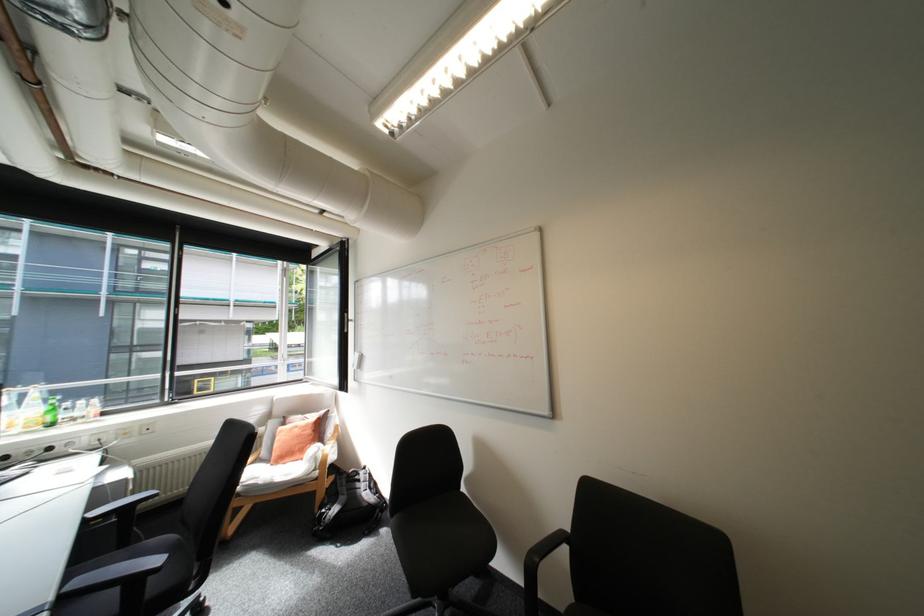
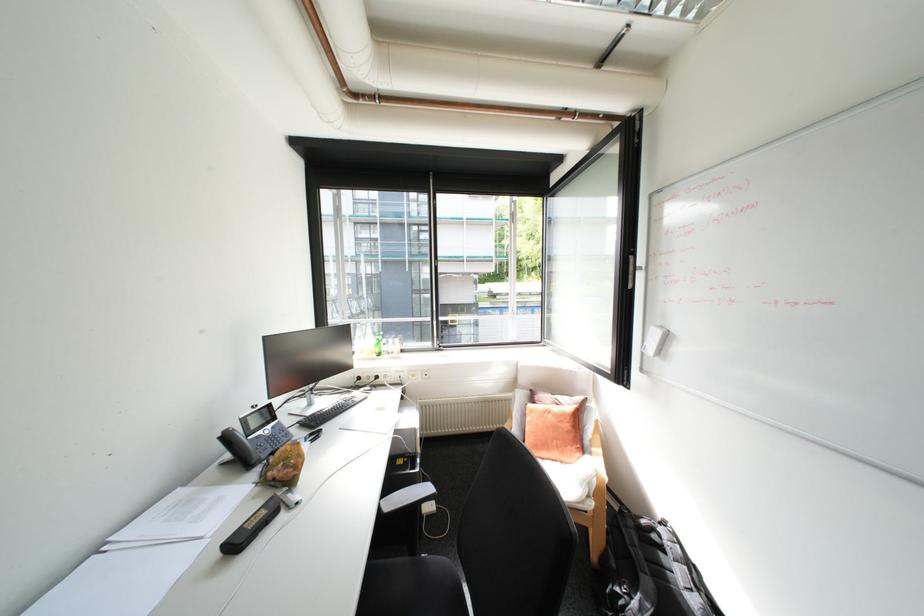
In the second image, find the point that corresponds to (x=38, y=427) in the first image.

(379, 354)